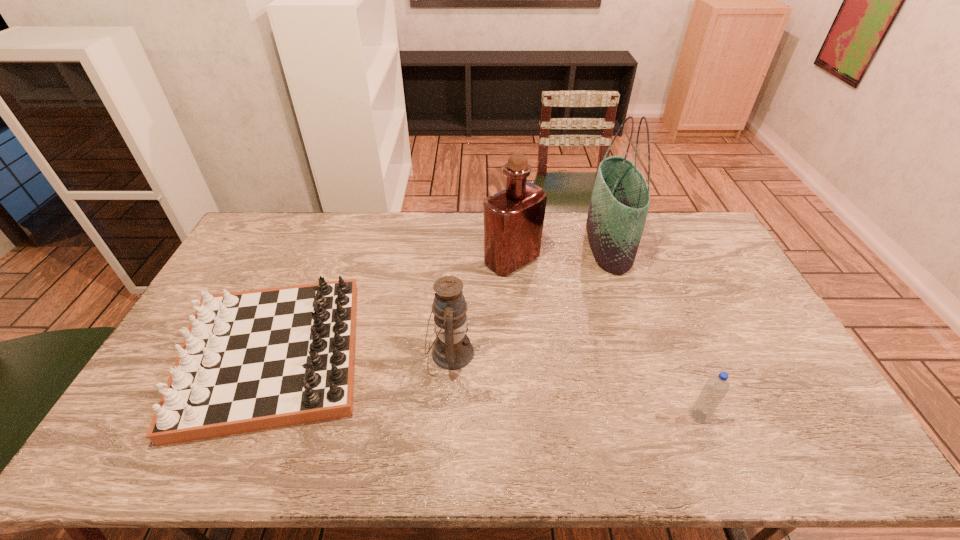
Where is `free region at the left edge of the desktop`? This screenshot has width=960, height=540. free region at the left edge of the desktop is located at coordinates (136, 417).

Identify the location of vacant area at the right edge of the desktop. (681, 255).

Image resolution: width=960 pixels, height=540 pixels. In order to click on vacant space at the far left corner in this screenshot , I will do `click(245, 240)`.

Locate an element on the screen. vacant area at the far right corner is located at coordinates (682, 233).

Locate an element on the screen. free space between the tallest object and the third tallest object is located at coordinates [529, 299].

Locate an element on the screen. The image size is (960, 540). free space that is in between the tallest object and the third shortest object is located at coordinates (529, 299).

The image size is (960, 540). I want to click on vacant space in between the tote bag and the third object from right to left, so click(560, 253).

Identify the location of free space between the tote bag and the liquor. (560, 253).

Identify the location of free area in between the second shortest object and the shortest object. (486, 386).

Where is `free spot between the oil lamp and the tote bag`? free spot between the oil lamp and the tote bag is located at coordinates (529, 299).